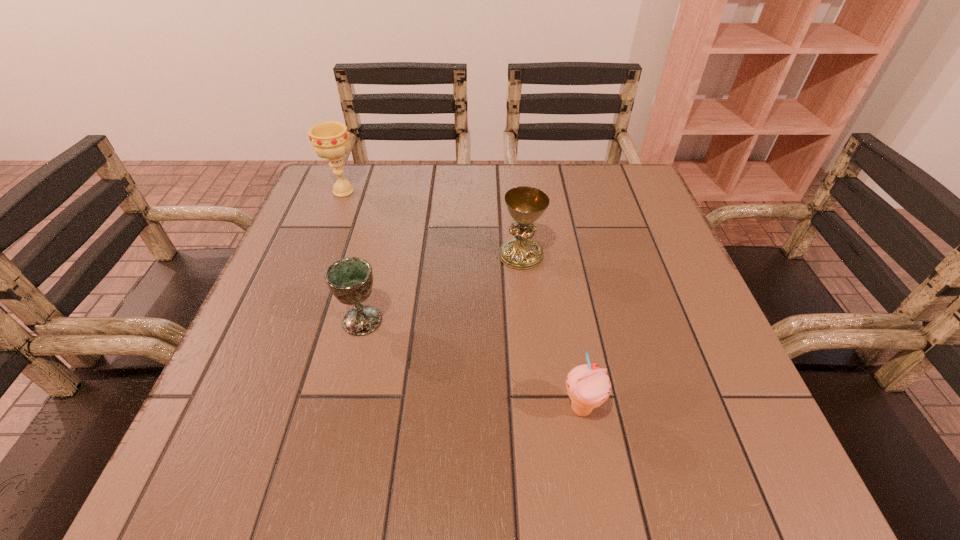
Locate an element on the screen. the leftmost chalice is located at coordinates (330, 140).

Identify the location of the leftmost object. This screenshot has height=540, width=960. (330, 140).

Locate an element on the screen. the second nearest chalice is located at coordinates (526, 205).

Locate an element on the screen. This screenshot has width=960, height=540. the rightmost chalice is located at coordinates (526, 205).

Locate an element on the screen. the second chalice from right to left is located at coordinates (x=350, y=279).

Locate an element on the screen. Image resolution: width=960 pixels, height=540 pixels. the shortest chalice is located at coordinates (350, 279).

Where is `icecream`? The height and width of the screenshot is (540, 960). icecream is located at coordinates (588, 386).

Locate an element on the screen. The width and height of the screenshot is (960, 540). free space located on the right of the leftmost object is located at coordinates pyautogui.click(x=439, y=191).

This screenshot has width=960, height=540. What are the coordinates of `vacant space located on the right of the second farthest chalice` in the screenshot? It's located at (565, 255).

Locate an element on the screen. This screenshot has height=540, width=960. blank area located 0.050m on the left of the second chalice from left to right is located at coordinates (315, 321).